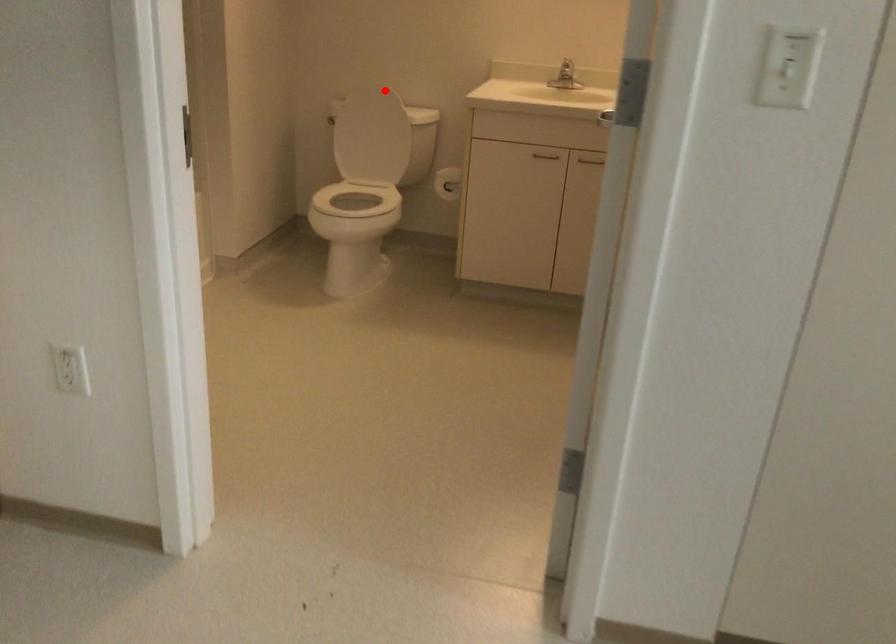
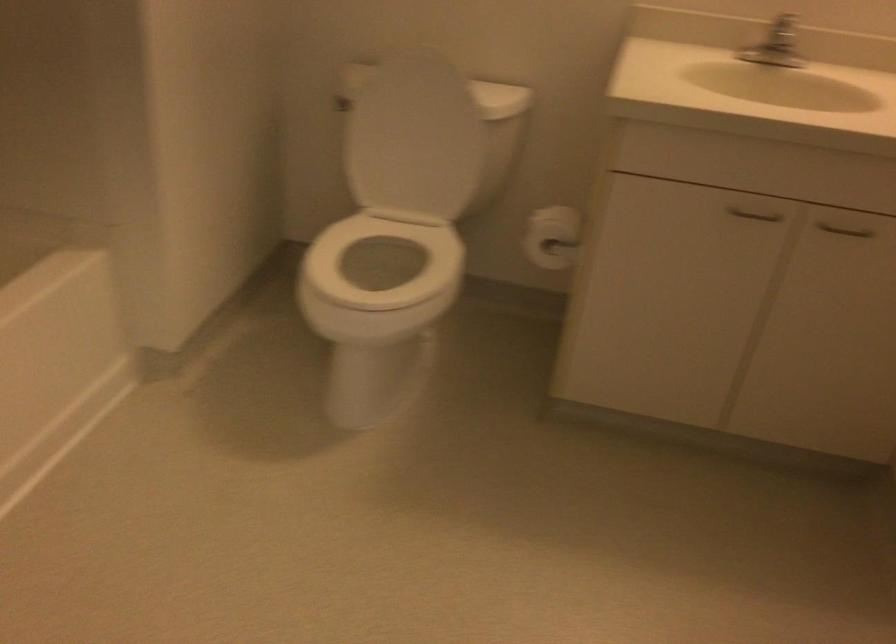
The point at the highlighted location is marked in the first image. Where is the corresponding point in the second image?

(440, 61)